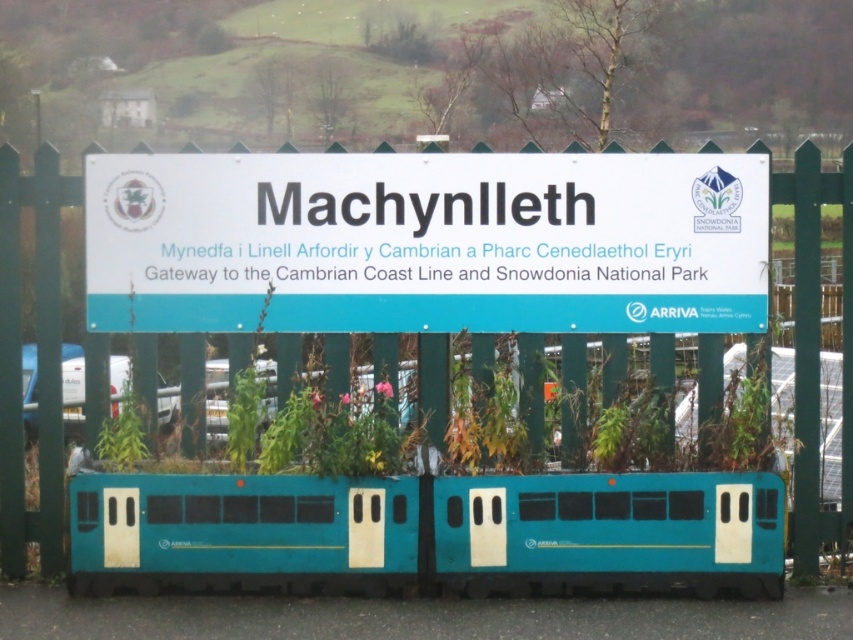
From the picture: You are a hiker planning to take a photo of the white plastic sign at center and the green wooden fence at center. Which object will appear smaller in the photo?

The white plastic sign at center will appear smaller in the photo because it occupies less space than the green wooden fence at center.

You are standing in front of a signboard on a green wooden fence. You see a white plastic sign at center and a teal matte train at center. Which object is positioned to the right?

The teal matte train at center is positioned to the right of the white plastic sign at center.

You are a traveler standing in front of the signboard and the fence. Which object is taller between the white plastic sign at center and the green wooden fence at center?

The green wooden fence at center is taller than the white plastic sign at center.